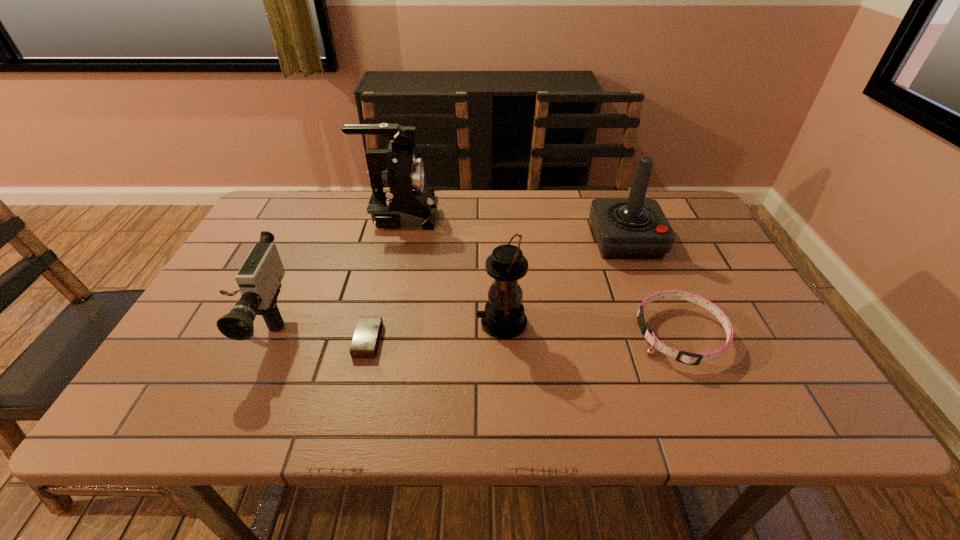
Image resolution: width=960 pixels, height=540 pixels. I want to click on object that is the second nearest to the farther camcorder, so click(504, 318).

In order to click on free space that satisfies the following two spatial constraints: 1. on the front-facing side of the joystick; 2. above the lantern, indicating its light source in this screenshot , I will do `click(659, 322)`.

What are the coordinates of `free space that satisfies the following two spatial constraints: 1. on the lens mount of the farther camcorder; 2. on the recording direction of the fourth tallest object` in the screenshot? It's located at pos(373,327).

The height and width of the screenshot is (540, 960). I want to click on free space that satisfies the following two spatial constraints: 1. on the front-facing side of the joystick; 2. above the third object from right to left, indicating its light source, so click(x=659, y=322).

Find the location of a particular element. Image resolution: width=960 pixels, height=540 pixels. free spot that satisfies the following two spatial constraints: 1. on the lens mount of the taller camcorder; 2. on the recording direction of the left camcorder is located at coordinates (373, 327).